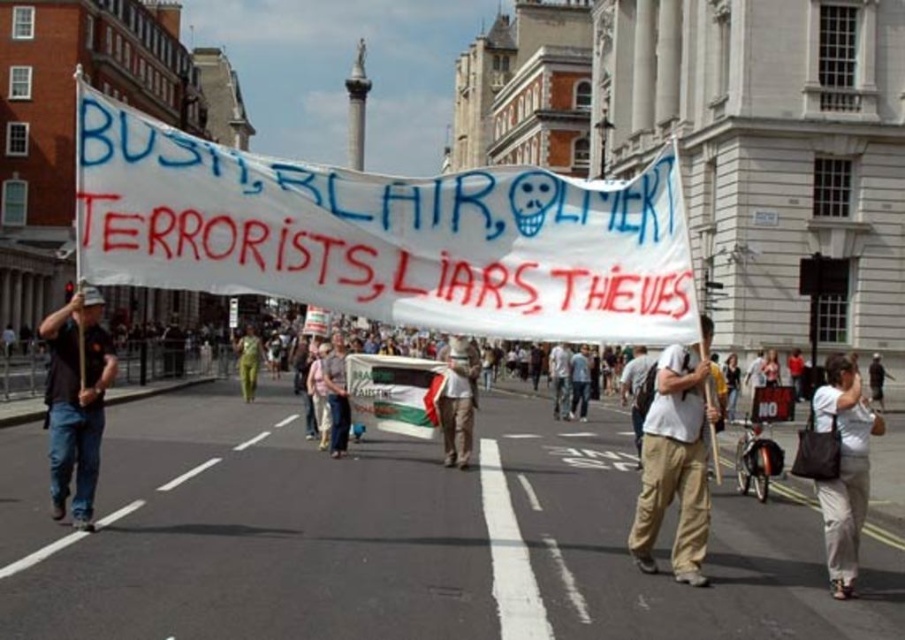
Is white fabric banner at center to the right of white cotton t-shirt at center from the viewer's perspective?

Incorrect, white fabric banner at center is not on the right side of white cotton t-shirt at center.

Does point (627, 186) come farther from viewer compared to point (661, 506)?

Yes, it is behind point (661, 506).

You are a GUI agent. You are given a task and a screenshot of the screen. Output one action in this format:
    pyautogui.click(x=<x>, y=<y>)
    Task: Click on the white fabric banner at center
    The image size is (905, 640).
    Given the screenshot: What is the action you would take?
    pyautogui.click(x=386, y=236)

Is black cotton shirt at left positioned at the back of denim pants at center?

No, black cotton shirt at left is closer to the viewer.

Is black cotton shirt at left closer to camera compared to denim pants at center?

Yes, it is in front of denim pants at center.

In order to click on black cotton shirt at left in this screenshot , I will do (x=75, y=401).

Is black cotton shirt at left closer to camera compared to white cotton shirt at lower right?

No, it is behind white cotton shirt at lower right.

Looking at this image, between black cotton shirt at left and white cotton shirt at lower right, which one appears on the left side from the viewer's perspective?

black cotton shirt at left is more to the left.

Is point (71, 438) farther from camera compared to point (853, 593)?

Yes, it is.

Identify the location of black cotton shirt at left. The image size is (905, 640). 75,401.